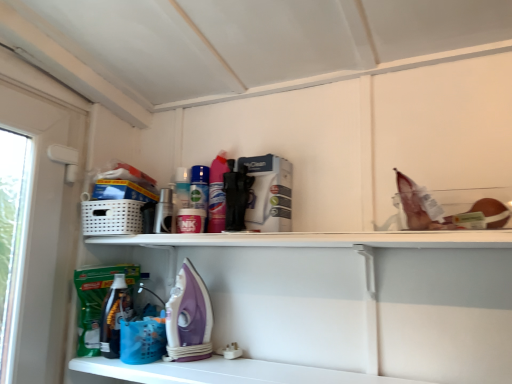
In order to face blue plastic basket at lower center, should I rotate leftwards or rightwards?

Turn left by 14.938 degrees to look at blue plastic basket at lower center.

The image size is (512, 384). I want to click on purple plastic iron at lower center, so click(188, 318).

Can you confirm if blue plastic basket at lower center is thinner than purple plastic iron at lower center?

No.

Looking at the image, does blue plastic basket at lower center seem bigger or smaller compared to purple plastic iron at lower center?

Considering their sizes, blue plastic basket at lower center takes up less space than purple plastic iron at lower center.

Is blue plastic basket at lower center looking in the opposite direction of purple plastic iron at lower center?

No, purple plastic iron at lower center is not at the back of blue plastic basket at lower center.

Is point (127, 333) behind point (193, 278)?

That is False.

Is purple plastic iron at lower center next to blue plastic basket at lower center and touching it?

Yes, purple plastic iron at lower center and blue plastic basket at lower center clearly make contact.

In the scene shown: Looking at their sizes, would you say purple plastic iron at lower center is wider or thinner than blue plastic basket at lower center?

Clearly, purple plastic iron at lower center has less width compared to blue plastic basket at lower center.

Is blue plastic basket at lower center located within purple plastic iron at lower center?

No, purple plastic iron at lower center does not contain blue plastic basket at lower center.

Does point (147, 352) come in front of point (121, 379)?

No, (147, 352) is further to viewer.

Can you confirm if blue plastic basket at lower center is shorter than white glossy shelf at lower center?

In fact, blue plastic basket at lower center may be taller than white glossy shelf at lower center.

From the image's perspective, relative to white glossy shelf at lower center, is blue plastic basket at lower center above or below?

Based on their image positions, blue plastic basket at lower center is located above white glossy shelf at lower center.

Between blue plastic basket at lower center and white glossy shelf at lower center, which one is positioned in front?

white glossy shelf at lower center is in front.

Is white glossy shelf at lower center next to purple plastic iron at lower center and touching it?

No, white glossy shelf at lower center is not beside purple plastic iron at lower center.

Is white glossy shelf at lower center bigger or smaller than purple plastic iron at lower center?

In the image, white glossy shelf at lower center appears to be larger than purple plastic iron at lower center.

Based on their positions, is white glossy shelf at lower center located to the left or right of purple plastic iron at lower center?

white glossy shelf at lower center is to the right of purple plastic iron at lower center.

Considering the relative positions of purple plastic iron at lower center and white glossy shelf at lower center in the image provided, is purple plastic iron at lower center in front of white glossy shelf at lower center?

That is False.

Between purple plastic iron at lower center and white glossy shelf at lower center, which one has smaller size?

purple plastic iron at lower center.

Which of these two, purple plastic iron at lower center or white glossy shelf at lower center, is wider?

white glossy shelf at lower center.

Consider the image. From the image's perspective, who appears lower, purple plastic iron at lower center or white glossy shelf at lower center?

From the image's view, white glossy shelf at lower center is below.

Who is shorter, white glossy shelf at lower center or blue plastic basket at lower center?

Standing shorter between the two is white glossy shelf at lower center.

Is white glossy shelf at lower center bigger or smaller than blue plastic basket at lower center?

Clearly, white glossy shelf at lower center is larger in size than blue plastic basket at lower center.

Is white glossy shelf at lower center positioned with its back to blue plastic basket at lower center?

white glossy shelf at lower center is not turned away from blue plastic basket at lower center.

Locate an element on the screen. appliance above the blue plastic basket at lower center (from the image's perspective) is located at coordinates (188, 318).

Locate an element on the screen. This screenshot has width=512, height=384. basket below the purple plastic iron at lower center (from the image's perspective) is located at coordinates (142, 340).

From the image, which object appears to be nearer to blue plastic basket at lower center, purple plastic iron at lower center or white glossy shelf at lower center?

Among the two, purple plastic iron at lower center is located nearer to blue plastic basket at lower center.

Considering their positions, is blue plastic basket at lower center positioned closer to purple plastic iron at lower center than white glossy shelf at lower center?

blue plastic basket at lower center is closer to purple plastic iron at lower center.

Which object lies further to the anchor point purple plastic iron at lower center, white glossy shelf at lower center or blue plastic basket at lower center?

white glossy shelf at lower center.

Looking at the image, which one is located further to white glossy shelf at lower center, blue plastic basket at lower center or purple plastic iron at lower center?

Among the two, blue plastic basket at lower center is located further to white glossy shelf at lower center.

Which object lies further to the anchor point blue plastic basket at lower center, white glossy shelf at lower center or purple plastic iron at lower center?

Among the two, white glossy shelf at lower center is located further to blue plastic basket at lower center.

Looking at the image, which one is located further to white glossy shelf at lower center, purple plastic iron at lower center or blue plastic basket at lower center?

blue plastic basket at lower center.

I want to click on appliance between white glossy shelf at lower center and blue plastic basket at lower center along the z-axis, so click(x=188, y=318).